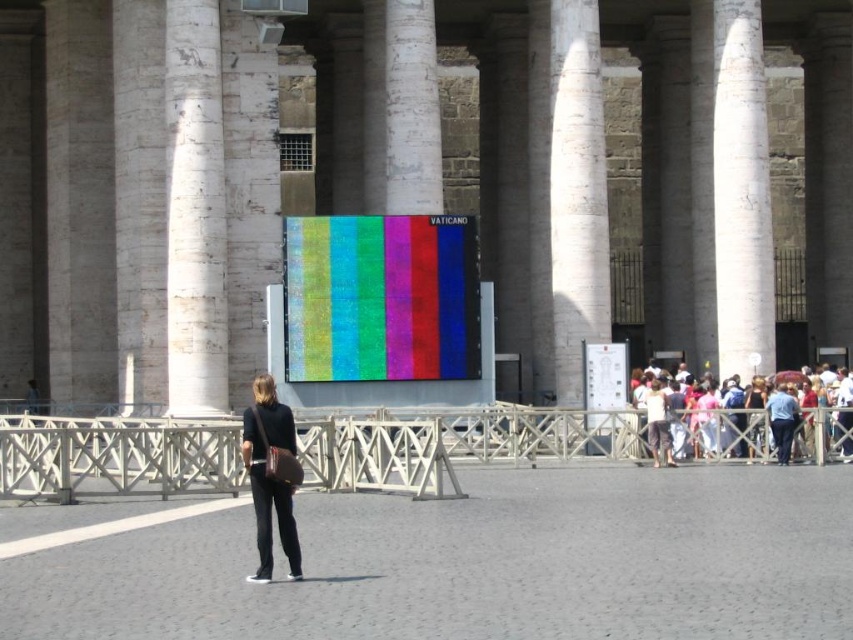
Does white marble pillar at left have a larger size compared to multicolored fabric crowd at right?

No, white marble pillar at left is not bigger than multicolored fabric crowd at right.

The width and height of the screenshot is (853, 640). Find the location of `white marble pillar at left`. white marble pillar at left is located at coordinates (194, 211).

Can you confirm if multicolored fabric crowd at right is positioned to the left of matte black pants at center?

Incorrect, multicolored fabric crowd at right is not on the left side of matte black pants at center.

Describe the element at coordinates (750, 426) in the screenshot. Image resolution: width=853 pixels, height=640 pixels. I see `multicolored fabric crowd at right` at that location.

At what (x,y) coordinates should I click in order to perform the action: click on multicolored fabric crowd at right. Please return your answer as a coordinate pair (x, y). This screenshot has height=640, width=853. Looking at the image, I should click on (750, 426).

Which is more to the left, textured fabric screen at center or matte black pants at center?

textured fabric screen at center

Is point (456, 289) in front of point (257, 413)?

No, (456, 289) is further to viewer.

The height and width of the screenshot is (640, 853). Find the location of `textured fabric screen at center`. textured fabric screen at center is located at coordinates (380, 298).